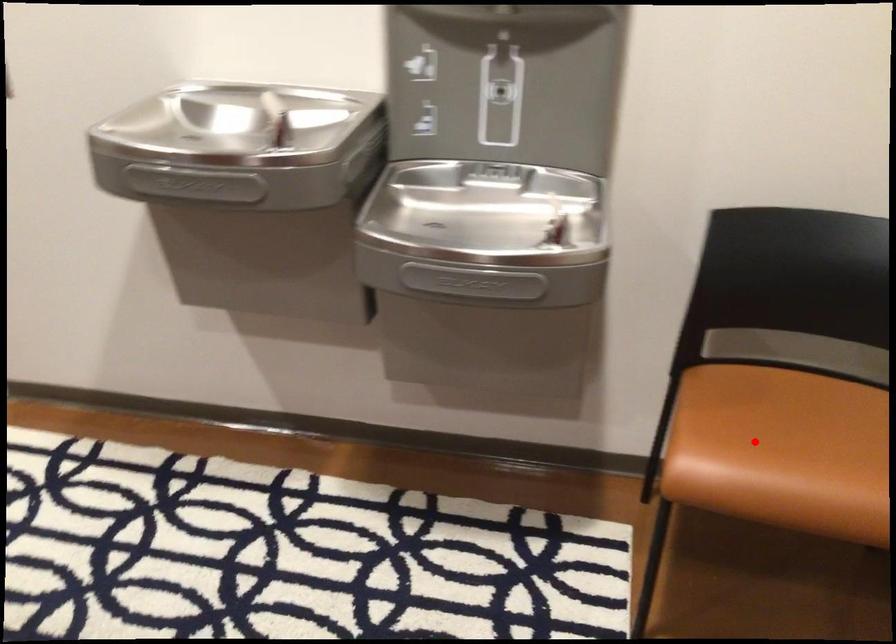
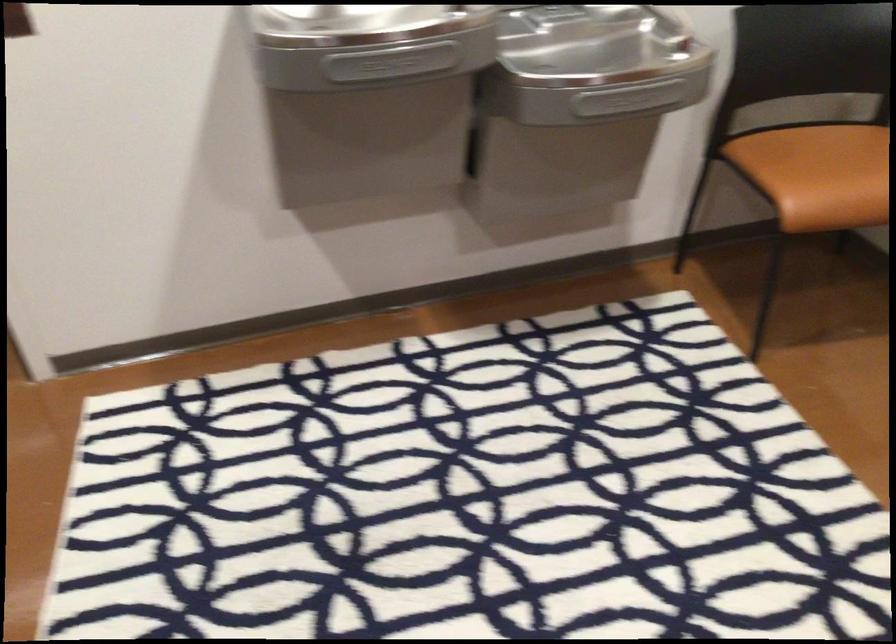
Where in the second image is the point corresponding to the highlighted location from the first image?

(821, 174)